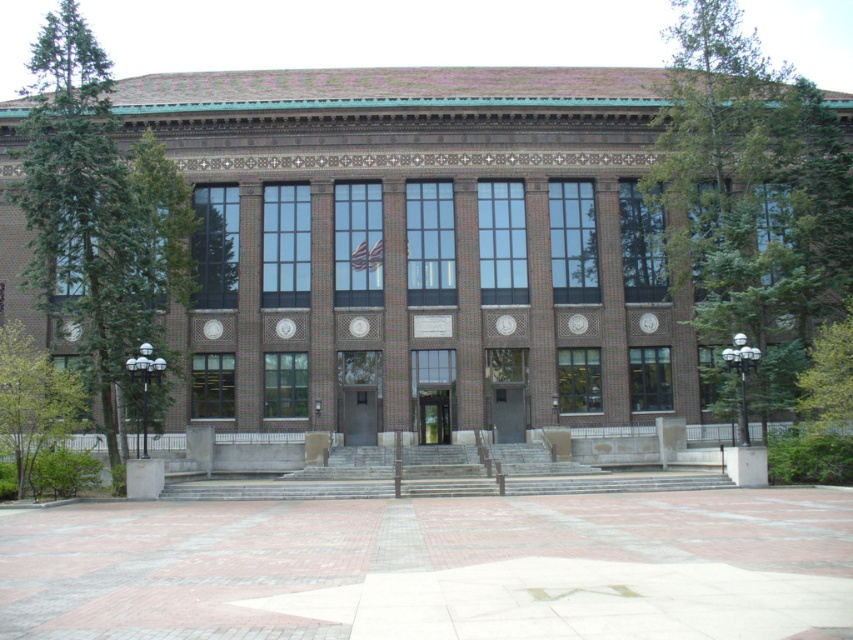
Can you confirm if green leafy tree at upper right is positioned to the right of green leafy tree at lower left?

Indeed, green leafy tree at upper right is positioned on the right side of green leafy tree at lower left.

Which is in front, point (682, 144) or point (74, 420)?

Point (74, 420) is in front.

At what (x,y) coordinates should I click in order to perform the action: click on green leafy tree at upper right. Please return your answer as a coordinate pair (x, y). This screenshot has height=640, width=853. Looking at the image, I should click on (749, 182).

Does green coniferous tree at left appear over green leafy tree at lower left?

Indeed, green coniferous tree at left is positioned over green leafy tree at lower left.

Which is more to the left, green coniferous tree at left or green leafy tree at lower left?

From the viewer's perspective, green coniferous tree at left appears more on the left side.

Where is `green coniferous tree at left`? The height and width of the screenshot is (640, 853). green coniferous tree at left is located at coordinates (97, 212).

Locate an element on the screen. This screenshot has height=640, width=853. green coniferous tree at left is located at coordinates (97, 212).

Which is in front, point (682, 250) or point (39, 120)?

Positioned in front is point (39, 120).

Which is below, green leafy tree at upper right or green coniferous tree at left?

green coniferous tree at left is below.

This screenshot has height=640, width=853. What do you see at coordinates (749, 182) in the screenshot?
I see `green leafy tree at upper right` at bounding box center [749, 182].

I want to click on green leafy tree at upper right, so click(749, 182).